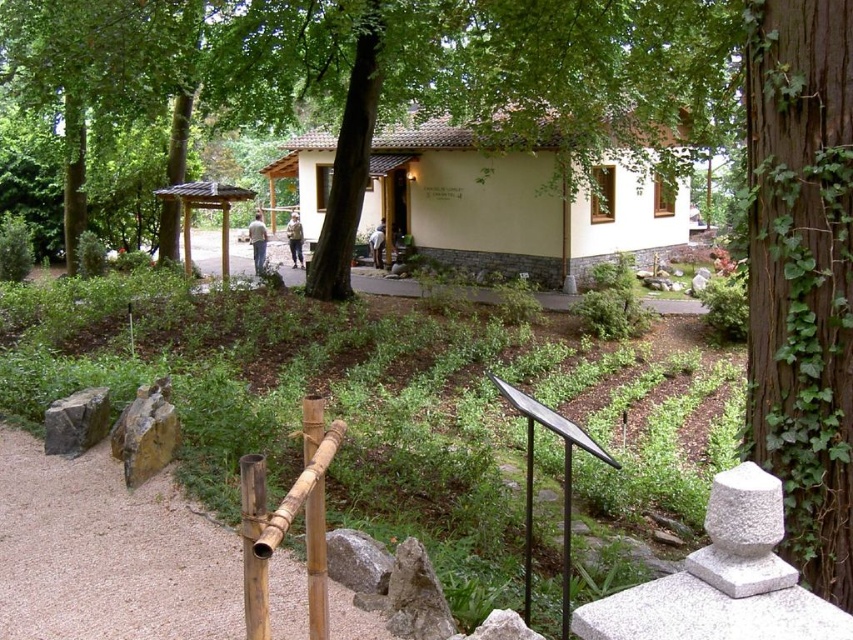
Is green leafy tree at center below green ivy-covered tree at right?

Actually, green leafy tree at center is above green ivy-covered tree at right.

Who is more distant from viewer, (x=467, y=38) or (x=747, y=218)?

The point (x=467, y=38) is more distant.

Which is behind, point (440, 49) or point (814, 356)?

The point (440, 49) is behind.

I want to click on green leafy tree at center, so click(x=398, y=72).

Is green leafy tree at center below gray rough rock at lower center?

No, green leafy tree at center is not below gray rough rock at lower center.

Measure the distance between point (148,54) and camera.

Point (148,54) and camera are 10.41 meters apart.

Where is `green leafy tree at center`? This screenshot has height=640, width=853. green leafy tree at center is located at coordinates (398, 72).

You are a GUI agent. You are given a task and a screenshot of the screen. Output one action in this format:
    pyautogui.click(x=<x>, y=<y>)
    Task: Click on the green leafy tree at center
    The image size is (853, 640).
    Given the screenshot: What is the action you would take?
    pyautogui.click(x=398, y=72)

Can you confirm if green ivy-covered tree at right is smaller than bamboo rail at lower center?

No.

Between point (769, 349) and point (306, 524), which one is positioned in front?

Point (306, 524) is in front.

The height and width of the screenshot is (640, 853). I want to click on green ivy-covered tree at right, so (x=802, y=276).